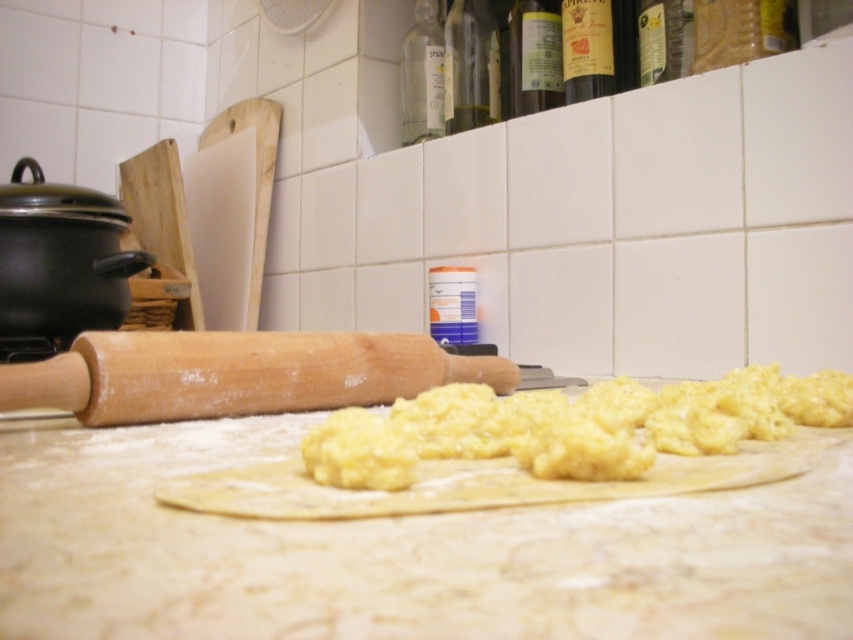
Between yellow dough at center and transparent glass bottle at upper center, which one is positioned lower?

yellow dough at center

Is point (759, 397) positioned before point (403, 90)?

Yes, point (759, 397) is in front of point (403, 90).

Is point (341, 448) closer to camera compared to point (410, 106)?

Yes, it is in front of point (410, 106).

At what (x,y) coordinates should I click in order to perform the action: click on yellow dough at center. Please return your answer as a coordinate pair (x, y). The width and height of the screenshot is (853, 640). Looking at the image, I should click on (572, 426).

Who is higher up, transparent glass bottle at upper center or shiny dark glass wine bottle at upper center?

transparent glass bottle at upper center is above.

You are a GUI agent. You are given a task and a screenshot of the screen. Output one action in this format:
    pyautogui.click(x=<x>, y=<y>)
    Task: Click on the transparent glass bottle at upper center
    Image resolution: width=853 pixels, height=640 pixels.
    Given the screenshot: What is the action you would take?
    pyautogui.click(x=422, y=74)

Does wooden rolling pin at center have a greater width compared to transparent plastic bottle at upper center?

Yes, wooden rolling pin at center is wider than transparent plastic bottle at upper center.

The image size is (853, 640). In order to click on wooden rolling pin at center in this screenshot , I will do `click(236, 374)`.

Between point (251, 365) and point (463, 52), which one is positioned behind?

Point (463, 52)

Find the location of a particular element. This screenshot has height=640, width=853. wooden rolling pin at center is located at coordinates (236, 374).